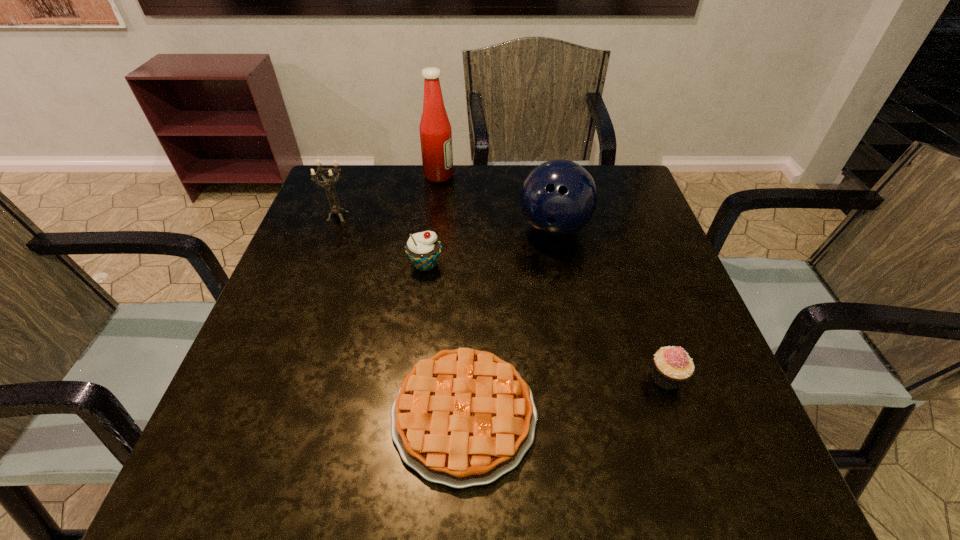
Locate an element on the screen. the tallest object is located at coordinates (435, 130).

The image size is (960, 540). I want to click on condiment, so click(x=435, y=130).

Locate an element on the screen. This screenshot has height=540, width=960. the fifth shortest object is located at coordinates (558, 198).

The height and width of the screenshot is (540, 960). What are the coordinates of `candle holder` in the screenshot? It's located at (335, 208).

Locate an element on the screen. This screenshot has height=540, width=960. the fourth shortest object is located at coordinates (335, 208).

I want to click on the farther cupcake, so click(x=423, y=249).

Where is `the left cupcake`? the left cupcake is located at coordinates (423, 249).

Find the location of a particular element. The image size is (960, 540). the right cupcake is located at coordinates (672, 366).

Find the location of a particular element. This screenshot has height=540, width=960. the rightmost object is located at coordinates (672, 366).

Identify the location of pie. (462, 418).